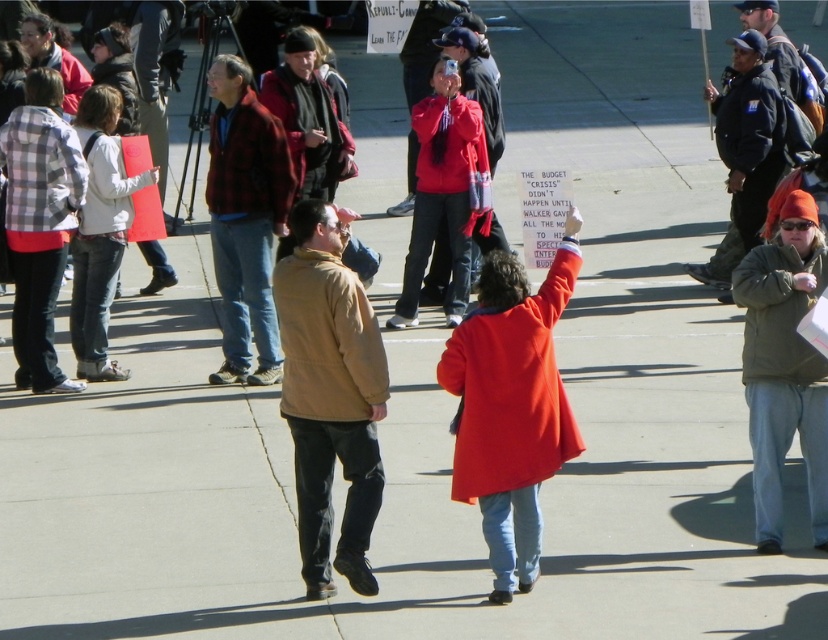
In the scene of a public gathering, you notice two people wearing distinctive clothing. One is wearing a brown matte jacket at center and the other a plaid flannel shirt at left. Based on their positions, which clothing item is positioned more to the right side of the image?

The brown matte jacket at center is positioned to the right of the plaid flannel shirt at left, so the brown matte jacket at center is more to the right.

You are a photographer standing at the edge of the crowd. You want to capture a photo that includes both the brown matte jacket at center and the plaid flannel shirt at left without any obstructions. Given that your camera has a maximum focal length that allows capturing objects up to 4 meters apart in the same frame, will you be able to include both subjects in the photo?

The distance between the brown matte jacket at center and the plaid flannel shirt at left is 3.84 meters, which is within the camera maximum focal length of 4 meters. Therefore, you can capture both subjects in the same photo without obstructions.